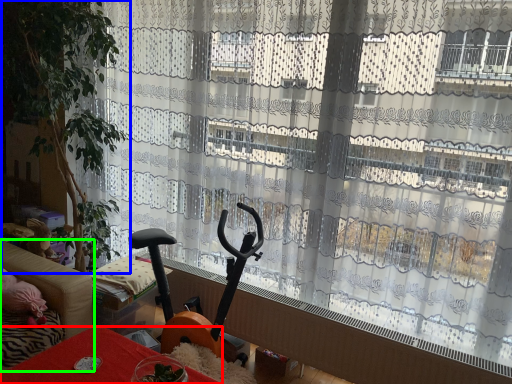
Question: Based on their relative distances, which object is nearer to furniture (highlighted by a red box)? Choose from plant (highlighted by a blue box) and studio couch (highlighted by a green box).

Choices:
 (A) plant
 (B) studio couch

Answer: (B)